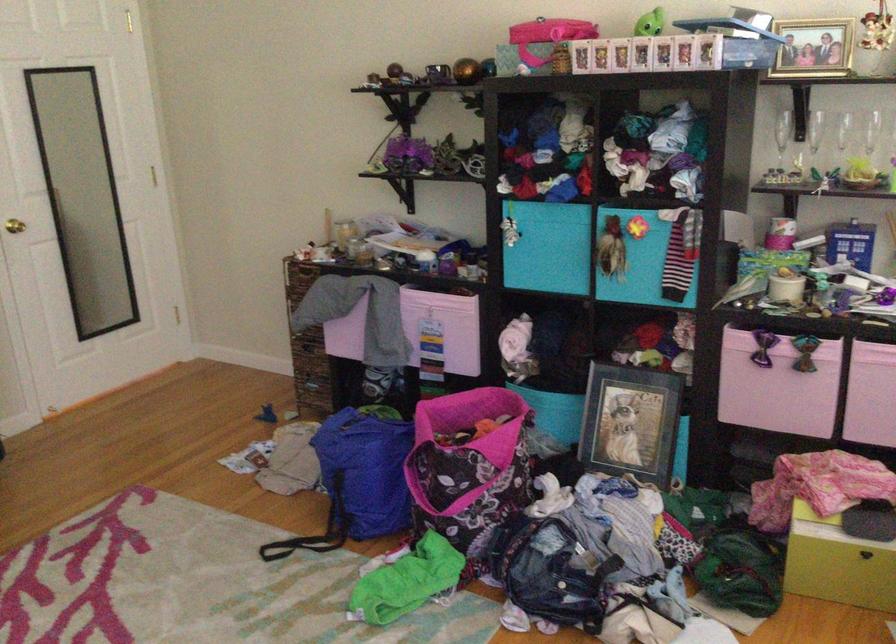
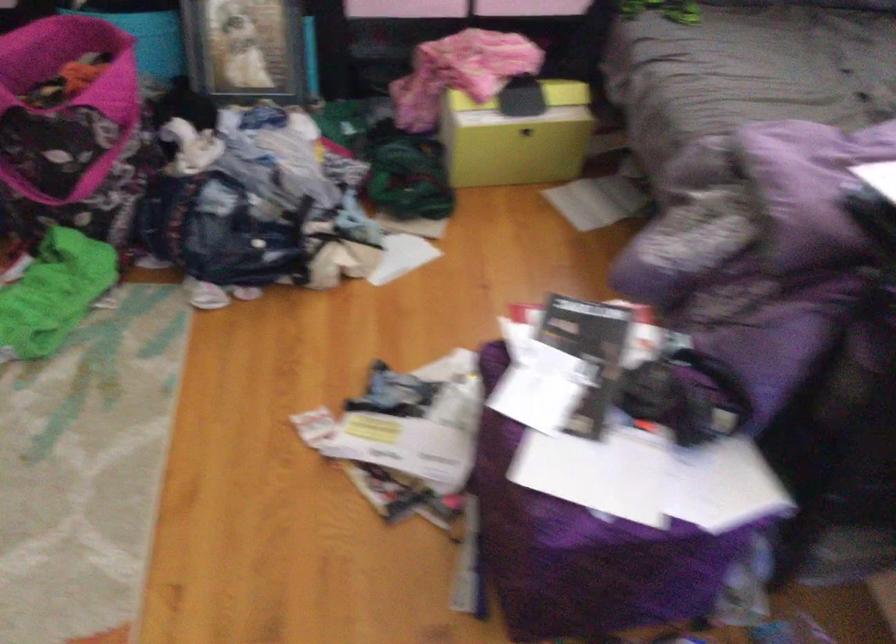
How did the camera likely rotate?

The camera's rotation is toward right-down.